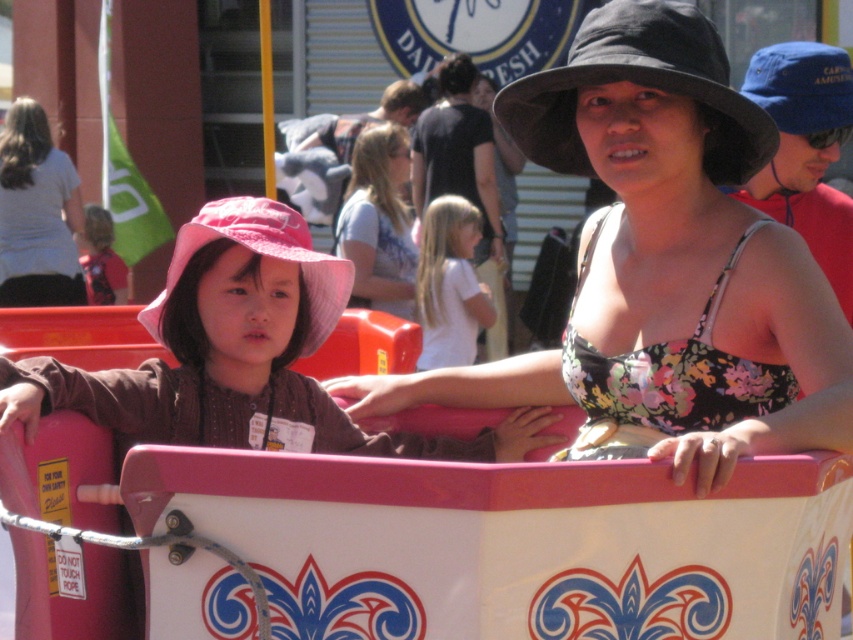
You are a tailor who needs to determine which clothing item requires more fabric to make between the floral fabric tank top at center and the pink fabric hat at left. Based on the description, which one would need more fabric?

The floral fabric tank top at center requires more fabric because it has a larger size compared to the pink fabric hat at left.

In the scene shown: You are a photographer trying to capture a candid shot of the two people at the fairground. You want to ensure both the floral fabric tank top at center and the white cotton shirt at center are visible in the frame. Based on their positions, which one should you focus on first to include both in the shot?

The floral fabric tank top at center is positioned on the right side of white cotton shirt at center, so you should focus on the white cotton shirt at center first to ensure both are included in the frame.

Consider the image. You are designing a new ride safety manual and need to ensure that all clothing items worn by riders are securely fastened. The manual requires knowing which clothing item between the floral fabric tank top at center and the pink fabric hat at center has a smaller width to prevent it from getting caught in the ride mechanisms. Which clothing item has a smaller width?

The floral fabric tank top at center has a smaller width than the pink fabric hat at center, so it is the clothing item with the smaller width that needs to be secured to prevent it from getting caught in the ride mechanisms.